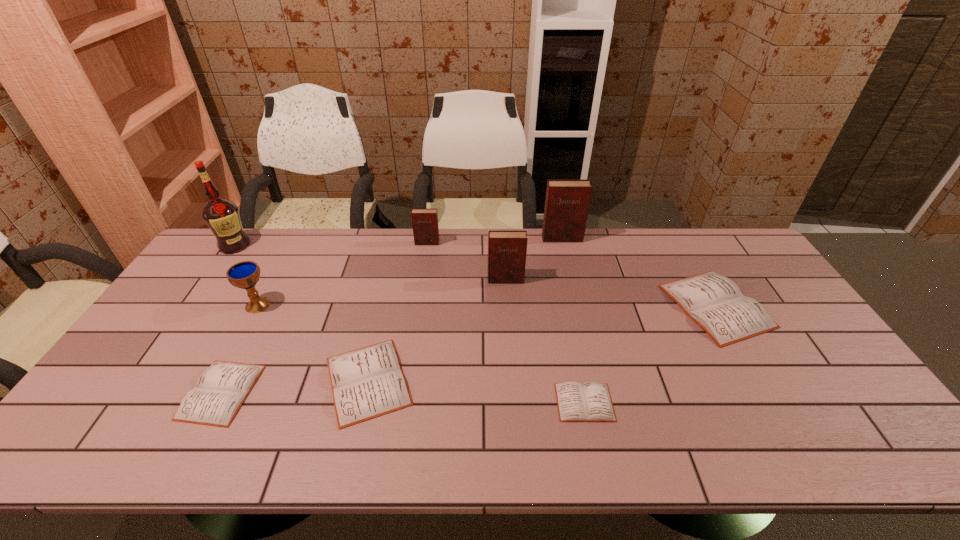
Find the location of a particular element. This screenshot has height=540, width=960. empty location between the second reddish-brown diary from right to left and the biggest white diary is located at coordinates (611, 293).

This screenshot has height=540, width=960. Find the location of `vacant area that lies between the third tallest diary and the second white diary from right to left`. vacant area that lies between the third tallest diary and the second white diary from right to left is located at coordinates (506, 323).

This screenshot has width=960, height=540. I want to click on free area in between the tallest diary and the biggest white diary, so click(x=639, y=272).

In order to click on free space between the shortest object and the blue chalice in this screenshot , I will do (421, 354).

Locate an element on the screen. The width and height of the screenshot is (960, 540). vacant area between the leftmost object and the second shortest object is located at coordinates (228, 319).

The height and width of the screenshot is (540, 960). I want to click on vacant space in between the rightmost white diary and the rightmost reddish-brown diary, so click(x=639, y=272).

Locate an element on the screen. vacant area that lies between the leftmost reddish-brown diary and the biggest white diary is located at coordinates tap(571, 274).

The height and width of the screenshot is (540, 960). I want to click on the seventh closest object to the chalice, so click(x=567, y=202).

The width and height of the screenshot is (960, 540). What are the coordinates of `the sixth closest object to the fourth shortest object` in the screenshot? It's located at point(221,389).

Locate which diary ranks sixth in proximity to the rightmost object. Please provide its 2D coordinates. Your answer should be formatted as a tuple, i.e. [(x, y)], where the tuple contains the x and y coordinates of a point satisfying the conditions above.

[(221, 389)]